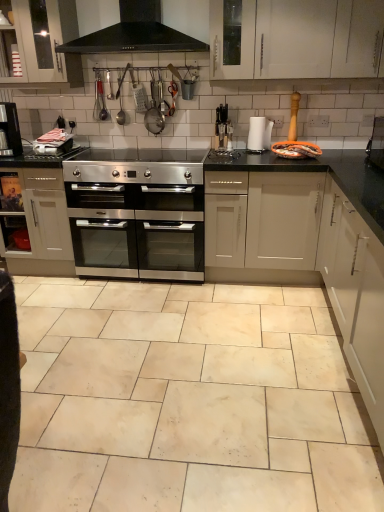
Question: In terms of height, does white paper towel at center, positioned as the first appliance in right-to-left order, look taller or shorter compared to white matte cabinet at right, which ranks as the 1th cabinetry in bottom-to-top order?

Choices:
 (A) tall
 (B) short

Answer: (B)

Question: Considering the positions of white paper towel at center, positioned as the first appliance in right-to-left order, and white matte cabinet at right, the third cabinetry viewed from the left, in the image, is white paper towel at center, positioned as the first appliance in right-to-left order, bigger or smaller than white matte cabinet at right, the third cabinetry viewed from the left,?

Choices:
 (A) small
 (B) big

Answer: (A)

Question: Which of these objects is positioned closest to the white glossy cabinet at upper left, marked as the 1th cabinetry in a top-to-bottom arrangement?

Choices:
 (A) black plastic coffee machine at center, which is the 1th appliance from left to right
 (B) satin silver oven at center, which is counted as the 3th cabinetry, starting from the right
 (C) black granite countertop at center
 (D) black matte exhaust hood at upper center
 (E) white paper towel at center, the 2th appliance positioned from the left

Answer: (D)

Question: Based on their relative distances, which object is farther from the black matte exhaust hood at upper center?

Choices:
 (A) stainless steel gas stove at center
 (B) white paper towel at center, positioned as the first appliance in right-to-left order
 (C) white matte cabinet at right, which ranks as the 3th cabinetry in top-to-bottom order
 (D) stainless steel oven at center
 (E) black granite countertop at center

Answer: (C)